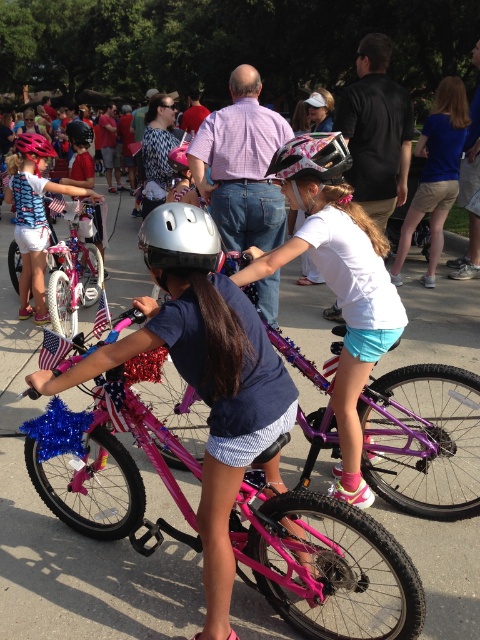
What object is located at the coordinates point (324, 564)?

The point (324, 564) corresponds to the pink metallic bicycle at center.

You are a photographer standing at the event. You want to take a closeup photo of the matte pink bicycle helmet at center. Given that your camera has a minimum focusing distance of 5 feet, will you be able to take the photo without moving closer?

The distance between the matte pink bicycle helmet at center and the camera is 8.68 feet, which is greater than the camera minimum focusing distance of 5 feet. Therefore, you can take the closeup photo without moving closer.